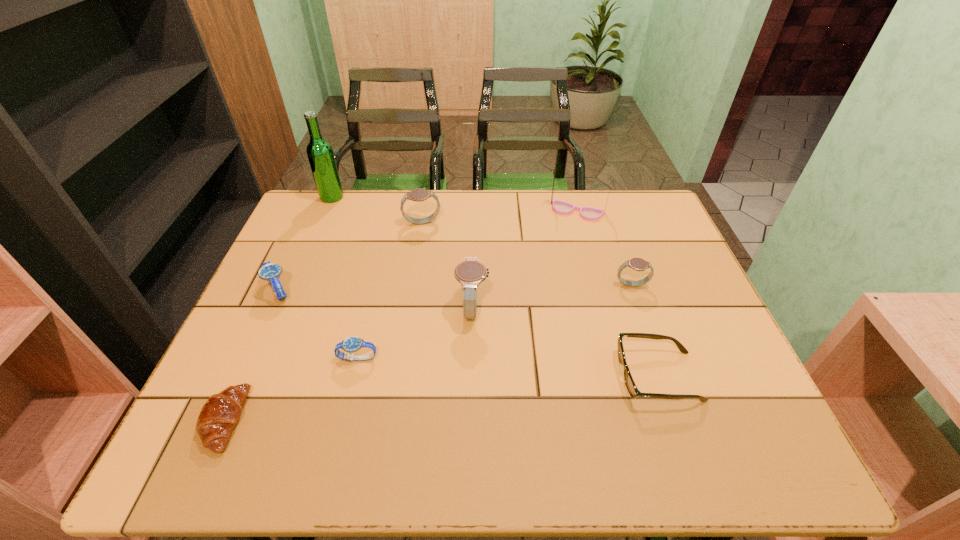
Locate an element on the screen. This screenshot has width=960, height=540. beer bottle is located at coordinates (320, 154).

The image size is (960, 540). In order to click on the tallest object in this screenshot , I will do `click(320, 154)`.

Find the location of a particular element. This screenshot has height=540, width=960. the farther spectacles is located at coordinates (560, 207).

Locate an element on the screen. This screenshot has width=960, height=540. pink spectacles is located at coordinates (560, 207).

The height and width of the screenshot is (540, 960). Identify the location of the second gray watch from left to right. (470, 272).

The height and width of the screenshot is (540, 960). I want to click on the second watch from right to left, so click(470, 272).

Locate an element on the screen. This screenshot has height=540, width=960. the second biggest gray watch is located at coordinates (420, 194).

You are a GUI agent. You are given a task and a screenshot of the screen. Output one action in this format:
    pyautogui.click(x=<x>, y=<y>)
    Task: Click on the farthest gray watch
    
    Given the screenshot: What is the action you would take?
    tap(420, 194)

At what (x,y) coordinates should I click in order to perform the action: click on the rightmost watch. Please return your answer as a coordinate pair (x, y). The image size is (960, 540). Looking at the image, I should click on (638, 264).

Image resolution: width=960 pixels, height=540 pixels. In order to click on the rightmost gray watch in this screenshot , I will do `click(638, 264)`.